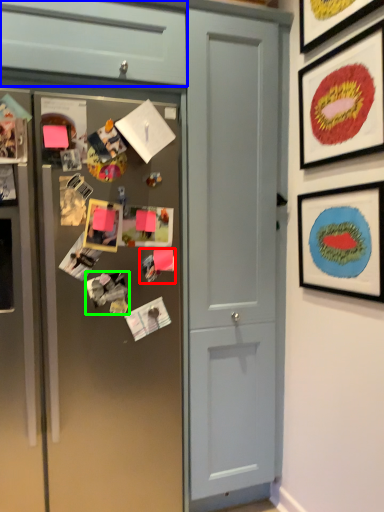
Question: Considering the real-world distances, which object is closest to art (highlighted by a red box)? cabinetry (highlighted by a blue box) or art (highlighted by a green box).

Choices:
 (A) cabinetry
 (B) art

Answer: (B)